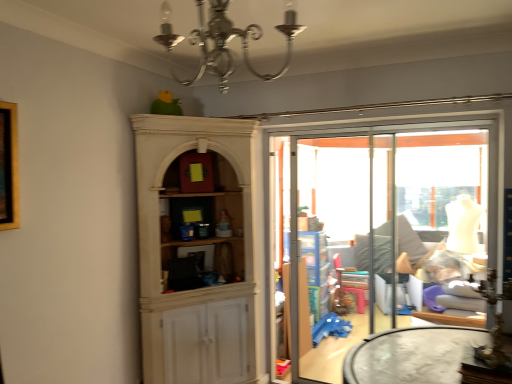
Question: Does transparent glass screen door at center have a smaller size compared to transparent glass window at center?

Choices:
 (A) yes
 (B) no

Answer: (B)

Question: Is transparent glass screen door at center in front of transparent glass window at center?

Choices:
 (A) yes
 (B) no

Answer: (B)

Question: From a real-world perspective, is transparent glass screen door at center positioned under transparent glass window at center based on gravity?

Choices:
 (A) yes
 (B) no

Answer: (A)

Question: From a real-world perspective, does transparent glass screen door at center stand above transparent glass window at center?

Choices:
 (A) no
 (B) yes

Answer: (A)

Question: Is transparent glass screen door at center oriented towards transparent glass window at center?

Choices:
 (A) no
 (B) yes

Answer: (A)

Question: From the image's perspective, is transparent glass screen door at center above transparent glass window at center?

Choices:
 (A) no
 (B) yes

Answer: (A)

Question: From a real-world perspective, is transparent glass screen door at center located beneath silver metallic chandelier at upper center?

Choices:
 (A) yes
 (B) no

Answer: (A)

Question: Does transparent glass screen door at center lie in front of silver metallic chandelier at upper center?

Choices:
 (A) no
 (B) yes

Answer: (A)

Question: Is transparent glass screen door at center smaller than silver metallic chandelier at upper center?

Choices:
 (A) yes
 (B) no

Answer: (B)

Question: Is transparent glass screen door at center oriented towards silver metallic chandelier at upper center?

Choices:
 (A) yes
 (B) no

Answer: (A)

Question: Would you consider transparent glass screen door at center to be distant from silver metallic chandelier at upper center?

Choices:
 (A) yes
 (B) no

Answer: (A)

Question: From a real-world perspective, is transparent glass screen door at center located higher than silver metallic chandelier at upper center?

Choices:
 (A) no
 (B) yes

Answer: (A)

Question: Does silver metallic chandelier at upper center have a smaller size compared to transparent glass screen door at center?

Choices:
 (A) no
 (B) yes

Answer: (B)